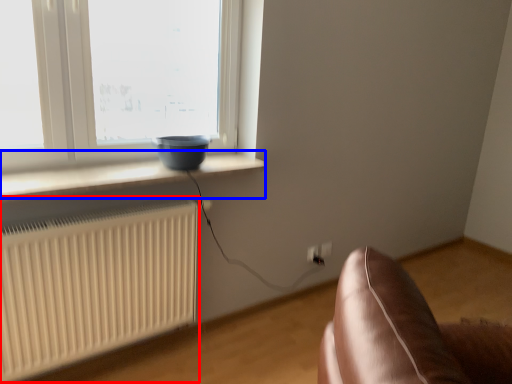
Question: Which of the following is the farthest to the observer, radiator (highlighted by a red box) or window sill (highlighted by a blue box)?

Choices:
 (A) radiator
 (B) window sill

Answer: (B)